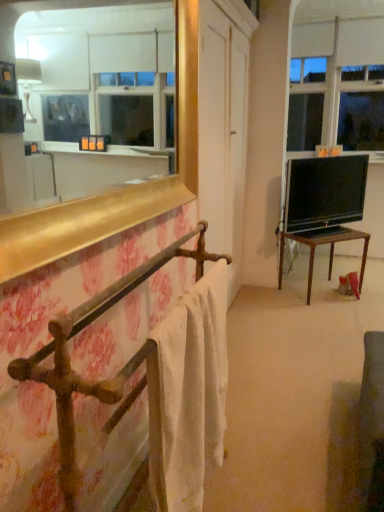
Question: Can you confirm if rusty metal towel rack at left is taller than black glossy tv at right?

Choices:
 (A) no
 (B) yes

Answer: (B)

Question: Does rusty metal towel rack at left turn towards black glossy tv at right?

Choices:
 (A) no
 (B) yes

Answer: (A)

Question: Is rusty metal towel rack at left closer to camera compared to black glossy tv at right?

Choices:
 (A) no
 (B) yes

Answer: (B)

Question: Is rusty metal towel rack at left looking in the opposite direction of black glossy tv at right?

Choices:
 (A) no
 (B) yes

Answer: (A)

Question: Can we say rusty metal towel rack at left lies outside black glossy tv at right?

Choices:
 (A) no
 (B) yes

Answer: (B)

Question: From the image's perspective, relative to white cotton towel at left, is transparent glass window at upper right above or below?

Choices:
 (A) below
 (B) above

Answer: (B)

Question: In the image, is transparent glass window at upper right on the left side or the right side of white cotton towel at left?

Choices:
 (A) right
 (B) left

Answer: (A)

Question: Considering their positions, is transparent glass window at upper right located in front of or behind white cotton towel at left?

Choices:
 (A) behind
 (B) front

Answer: (A)

Question: Is point (349, 134) positioned closer to the camera than point (160, 389)?

Choices:
 (A) closer
 (B) farther

Answer: (B)

Question: Would you say rusty metal towel rack at left is to the left or to the right of transparent glass window at upper right in the picture?

Choices:
 (A) left
 (B) right

Answer: (A)

Question: From the image's perspective, is rusty metal towel rack at left located above or below transparent glass window at upper right?

Choices:
 (A) below
 (B) above

Answer: (A)

Question: Is rusty metal towel rack at left taller or shorter than transparent glass window at upper right?

Choices:
 (A) tall
 (B) short

Answer: (B)

Question: In terms of width, does rusty metal towel rack at left look wider or thinner when compared to transparent glass window at upper right?

Choices:
 (A) wide
 (B) thin

Answer: (A)

Question: From the image's perspective, is black glossy tv at right positioned above or below transparent glass window at upper right?

Choices:
 (A) above
 (B) below

Answer: (B)

Question: Is black glossy tv at right in front of or behind transparent glass window at upper right in the image?

Choices:
 (A) front
 (B) behind

Answer: (A)